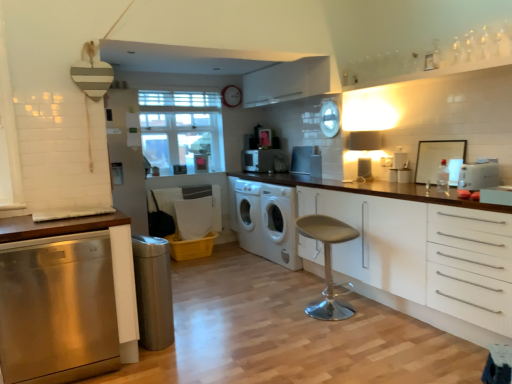
Question: From the image's perspective, is white matte washing machine at center, the 2th washing machine viewed from the front, under clear glass window at center?

Choices:
 (A) yes
 (B) no

Answer: (A)

Question: Does white matte washing machine at center, positioned as the first washing machine in back-to-front order, come in front of clear glass window at center?

Choices:
 (A) no
 (B) yes

Answer: (A)

Question: Considering the relative sizes of white matte washing machine at center, positioned as the first washing machine in back-to-front order, and clear glass window at center in the image provided, is white matte washing machine at center, positioned as the first washing machine in back-to-front order, smaller than clear glass window at center?

Choices:
 (A) no
 (B) yes

Answer: (B)

Question: Is white matte washing machine at center, the 2th washing machine viewed from the front, directly adjacent to clear glass window at center?

Choices:
 (A) no
 (B) yes

Answer: (A)

Question: Does white matte washing machine at center, the 2th washing machine viewed from the front, have a lesser width compared to clear glass window at center?

Choices:
 (A) no
 (B) yes

Answer: (A)

Question: Is white matte washing machine at center, the 2th washing machine viewed from the front, far away from clear glass window at center?

Choices:
 (A) no
 (B) yes

Answer: (A)

Question: From the image's perspective, is satin silver trash can at lower left, which is the fifth appliance in top-to-bottom order, located above stainless steel dishwasher at left, which appears as the second cabinetry when viewed from the right?

Choices:
 (A) yes
 (B) no

Answer: (B)

Question: Does satin silver trash can at lower left, marked as the first appliance in a front-to-back arrangement, appear on the left side of stainless steel dishwasher at left, which appears as the second cabinetry when viewed from the right?

Choices:
 (A) no
 (B) yes

Answer: (A)

Question: Can you confirm if satin silver trash can at lower left, which ranks as the 1th appliance in left-to-right order, is shorter than stainless steel dishwasher at left, which appears as the second cabinetry when viewed from the right?

Choices:
 (A) yes
 (B) no

Answer: (A)

Question: Does satin silver trash can at lower left, which ranks as the 1th appliance in left-to-right order, turn towards stainless steel dishwasher at left, arranged as the first cabinetry when viewed from the left?

Choices:
 (A) no
 (B) yes

Answer: (A)

Question: Is satin silver trash can at lower left, marked as the first appliance in a front-to-back arrangement, to the right of stainless steel dishwasher at left, arranged as the first cabinetry when viewed from the left, from the viewer's perspective?

Choices:
 (A) no
 (B) yes

Answer: (B)

Question: Is satin silver trash can at lower left, which is the 1th appliance from bottom to top, positioned far away from stainless steel dishwasher at left, arranged as the first cabinetry when viewed from the left?

Choices:
 (A) yes
 (B) no

Answer: (B)

Question: Is white glossy microwave at center, acting as the fifth appliance starting from the bottom, taller than satin silver trash can at lower left, which ranks as the 1th appliance in left-to-right order?

Choices:
 (A) no
 (B) yes

Answer: (A)